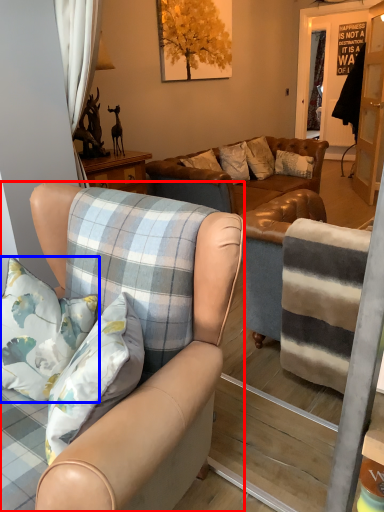
Question: Which object is further to the camera taking this photo, chair (highlighted by a red box) or pillow (highlighted by a blue box)?

Choices:
 (A) chair
 (B) pillow

Answer: (B)